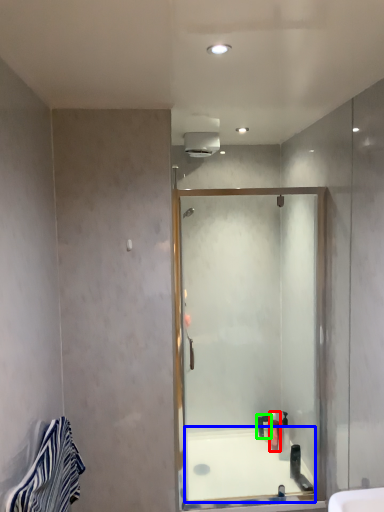
Question: Which is nearer to the toiletry (highlighted by a red box)? bath (highlighted by a blue box) or toiletry (highlighted by a green box).

Choices:
 (A) bath
 (B) toiletry

Answer: (B)